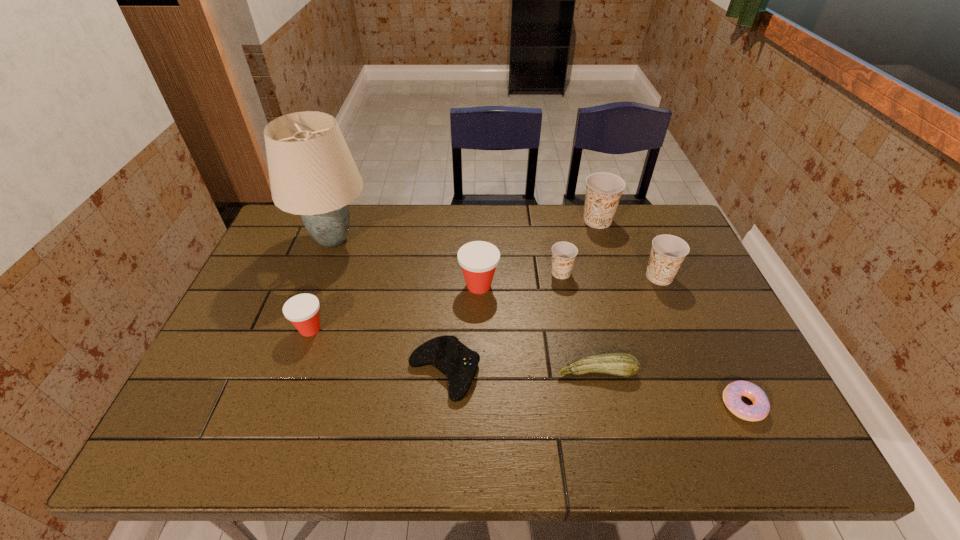
This screenshot has width=960, height=540. I want to click on doughnut that is at the right edge, so point(732,394).

Find the location of a particular element. This screenshot has width=960, height=540. object that is at the far left corner is located at coordinates click(312, 173).

At what (x,y) coordinates should I click in order to perform the action: click on object positioned at the near right corner. Please return your answer as a coordinate pair (x, y). This screenshot has height=540, width=960. Looking at the image, I should click on (732, 394).

Identify the location of vacant space at the far edge of the desktop. The image size is (960, 540). (472, 208).

Identify the location of free space at the near edge of the desktop. (300, 438).

Find the location of a particular element. The width and height of the screenshot is (960, 540). vacant space at the left edge is located at coordinates (281, 314).

Image resolution: width=960 pixels, height=540 pixels. In the image, there is a desktop. Find the location of `free space at the right edge`. free space at the right edge is located at coordinates (707, 287).

Where is `free space at the near left corner of the desktop`? The height and width of the screenshot is (540, 960). free space at the near left corner of the desktop is located at coordinates (208, 439).

Where is `vacant space at the far right corner`? vacant space at the far right corner is located at coordinates (680, 227).

Find the location of a particular element. The width and height of the screenshot is (960, 540). vacant region between the right red-orange Dixie cup and the nearer red-orange Dixie cup is located at coordinates (395, 307).